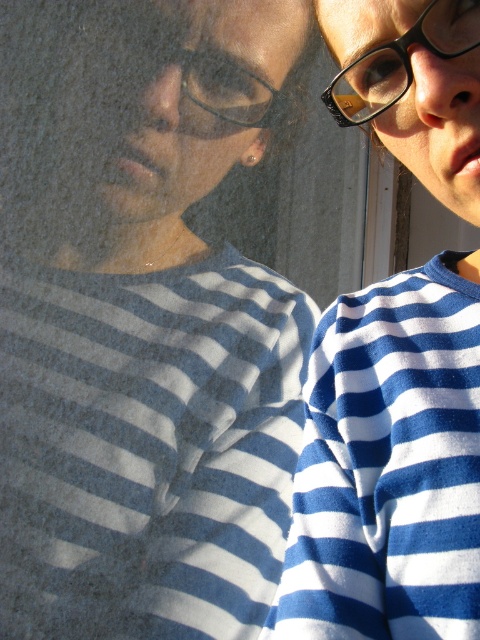
You are standing in front of a window and see the reflection of a person wearing a blue and white horizontally striped shirt. The reflection shows the same striped shirt and part of the person face, which includes glasses and an earring. The blue striped sweater at center is located at point [388,467]. Where is the blue striped sweater at center in the reflection?

The blue striped sweater at center is located at point [388,467] in the reflection as well.

You are an interior designer assessing the reflection on the window. You see the blue striped shirt at center and the black plastic glasses at upper center in the reflection. Which object in the reflection takes up more space?

The blue striped shirt at center takes up more space in the reflection because it is bigger than the black plastic glasses at upper center.

You are trying to locate the black plastic glasses at upper right in the image. According to the coordinates provided, where exactly would you find them?

The black plastic glasses at upper right are located at point coordinates of [400,61].